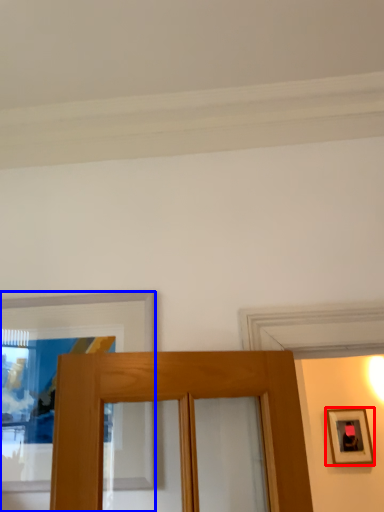
Question: Which object appears farthest to the camera in this image, picture frame (highlighted by a red box) or picture frame (highlighted by a blue box)?

Choices:
 (A) picture frame
 (B) picture frame

Answer: (A)